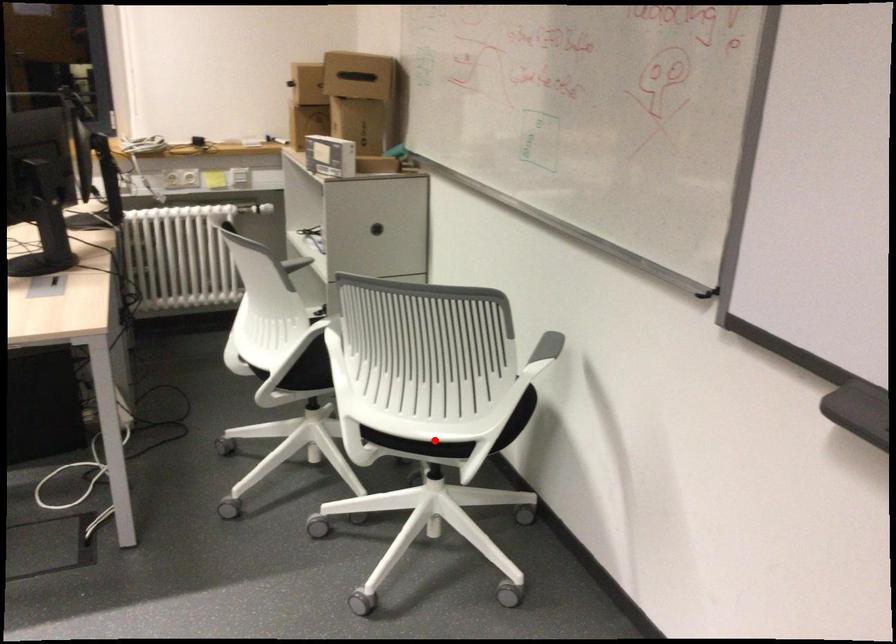
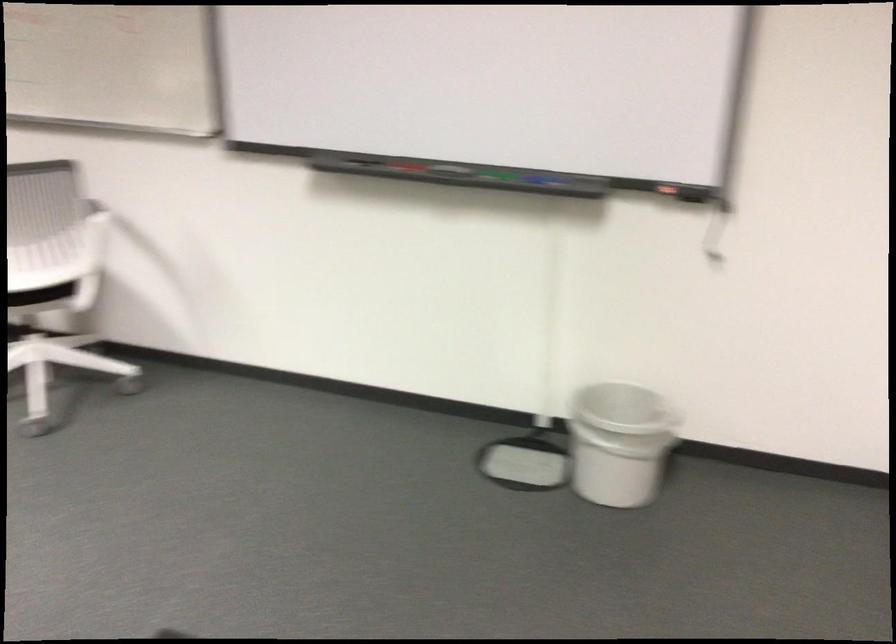
Question: I am providing you with two images of the same scene from different viewpoints. A red point is marked on the first image. Can you still see the location of the red point in image 2?

Choices:
 (A) Yes
 (B) No

Answer: (A)